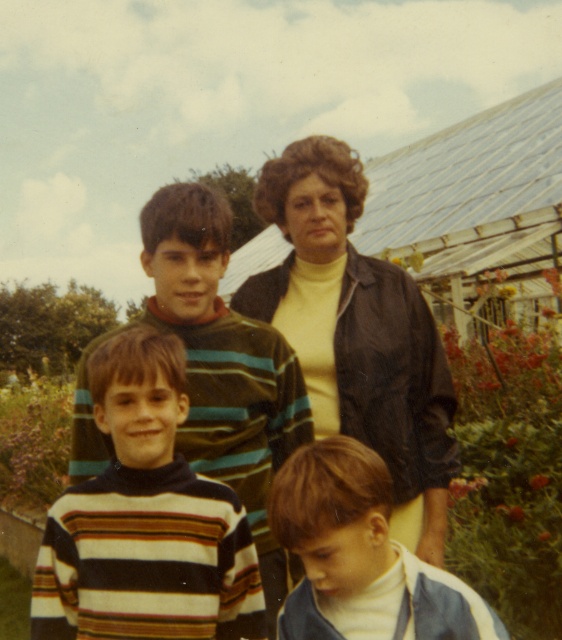
You are a photographer setting up for a family photo. You notice two jackets in the scene, the matte black jacket at center and the denim jacket at lower right. Which jacket should you adjust to ensure it doesn not block the background greenhouse? Explain your reasoning based on their sizes.

The matte black jacket at center is larger in size than the denim jacket at lower right. Since the larger matte black jacket at center might block more of the background greenhouse, you should adjust its position to ensure it doesn not obstruct the view.

You are standing in the garden and see the point marked at coordinates (301, 349). Which object is this point located on?

The point at (301, 349) is located on the striped wool sweater at center.

What is located at the point with coordinates [146,518]?

The striped turtleneck sweater at center is located at point [146,518].